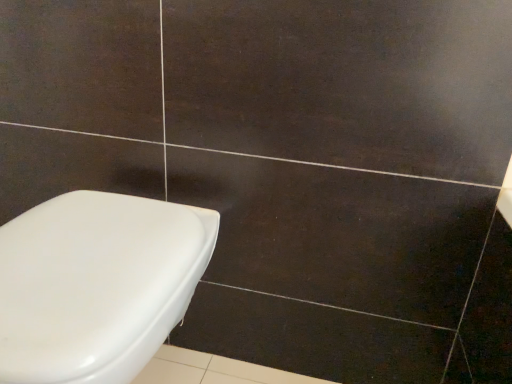
What are the coordinates of `white glossy toilet at lower left` in the screenshot? It's located at (x=96, y=284).

Describe the element at coordinates (96, 284) in the screenshot. I see `white glossy toilet at lower left` at that location.

The image size is (512, 384). Find the location of `white glossy toilet at lower left`. white glossy toilet at lower left is located at coordinates (96, 284).